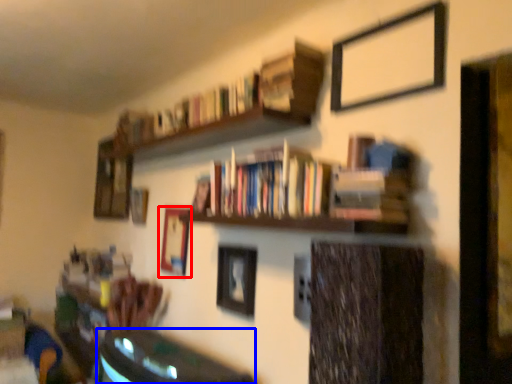
Question: Among these objects, which one is nearest to the camera, picture frame (highlighted by a red box) or table (highlighted by a blue box)?

Choices:
 (A) picture frame
 (B) table

Answer: (B)